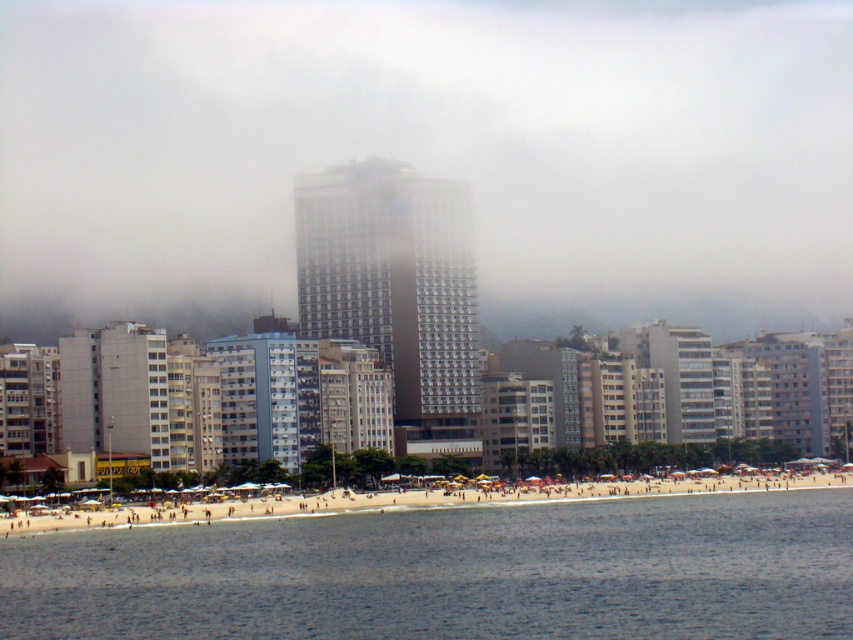
Can you confirm if clear blue water at beach center is wider than beige sand beach at lower center?

Incorrect, clear blue water at beach center's width does not surpass beige sand beach at lower center's.

Where is `clear blue water at beach center`? The height and width of the screenshot is (640, 853). clear blue water at beach center is located at coordinates (453, 572).

Does transparent fog at center have a lesser height compared to beige sand beach at lower center?

In fact, transparent fog at center may be taller than beige sand beach at lower center.

Between transparent fog at center and beige sand beach at lower center, which one appears on the left side from the viewer's perspective?

transparent fog at center

Who is more forward, (611, 189) or (498, 497)?

Point (498, 497)

I want to click on transparent fog at center, so click(x=433, y=152).

Which is more to the right, transparent fog at center or clear blue water at beach center?

From the viewer's perspective, transparent fog at center appears more on the right side.

Does point (525, 241) come closer to viewer compared to point (74, 556)?

No, (525, 241) is further to viewer.

Between point (781, 160) and point (374, 605), which one is positioned behind?

The point (781, 160) is more distant.

Where is `transparent fog at center`? This screenshot has height=640, width=853. transparent fog at center is located at coordinates (433, 152).